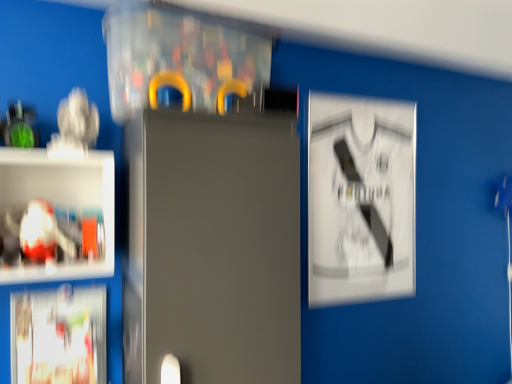
At what (x,y) coordinates should I click in order to perform the action: click on transparent plastic cabinet at upper center. Please return your answer as a coordinate pair (x, y). This screenshot has height=384, width=512. Looking at the image, I should click on (182, 57).

You are a GUI agent. You are given a task and a screenshot of the screen. Output one action in this format:
    pyautogui.click(x=<x>, y=<y>)
    Task: Click on the satin gray fridge at center
    The image size is (512, 384).
    Given the screenshot: What is the action you would take?
    pyautogui.click(x=212, y=248)

Identify the location of transparent plastic cabinet at upper center. The image size is (512, 384). (182, 57).

From the image's perspective, is white paper at upper right, which is counted as the first poster, starting from the right, located above translucent plastic shelf at left?

Yes, from the image's perspective, white paper at upper right, which is counted as the first poster, starting from the right, is above translucent plastic shelf at left.

Considering the relative sizes of white paper at upper right, acting as the 1th poster starting from the top, and translucent plastic shelf at left in the image provided, is white paper at upper right, acting as the 1th poster starting from the top, thinner than translucent plastic shelf at left?

Correct, the width of white paper at upper right, acting as the 1th poster starting from the top, is less than that of translucent plastic shelf at left.

How many degrees apart are the facing directions of white paper at upper right, the 2th poster from the left, and translucent plastic shelf at left?

The angular difference between white paper at upper right, the 2th poster from the left, and translucent plastic shelf at left is 0.109 degrees.

Could you tell me if white paper at upper right, acting as the 1th poster starting from the top, is facing translucent plastic shelf at left?

No, white paper at upper right, acting as the 1th poster starting from the top, is not facing towards translucent plastic shelf at left.

From a real-world perspective, relative to white glossy poster at lower left, acting as the 2th poster starting from the back, is satin gray fridge at center vertically above or below?

satin gray fridge at center is above white glossy poster at lower left, acting as the 2th poster starting from the back.

Considering the relative sizes of satin gray fridge at center and white glossy poster at lower left, which is counted as the first poster, starting from the left, in the image provided, is satin gray fridge at center shorter than white glossy poster at lower left, which is counted as the first poster, starting from the left,?

No, satin gray fridge at center is not shorter than white glossy poster at lower left, which is counted as the first poster, starting from the left.

Are satin gray fridge at center and white glossy poster at lower left, the 1th poster when ordered from front to back, located far from each other?

No, satin gray fridge at center is in close proximity to white glossy poster at lower left, the 1th poster when ordered from front to back.

Is the depth of satin gray fridge at center greater than that of white glossy poster at lower left, which is counted as the 2th poster, starting from the right?

No, it is in front of white glossy poster at lower left, which is counted as the 2th poster, starting from the right.

Are translucent plastic shelf at left and transparent plastic cabinet at upper center far apart?

translucent plastic shelf at left is actually quite close to transparent plastic cabinet at upper center.

In the scene shown: From the image's perspective, is translucent plastic shelf at left below transparent plastic cabinet at upper center?

Yes, from the image's perspective, translucent plastic shelf at left is below transparent plastic cabinet at upper center.

Based on the photo, could you tell me if translucent plastic shelf at left is turned towards transparent plastic cabinet at upper center?

No.

Is white paper at upper right, the 1th poster when ordered from back to front, turned away from white glossy poster at lower left, the first poster positioned from the bottom?

No, white paper at upper right, the 1th poster when ordered from back to front, is not facing the opposite direction of white glossy poster at lower left, the first poster positioned from the bottom.

From the image's perspective, relative to white glossy poster at lower left, the first poster positioned from the bottom, is white paper at upper right, the 2th poster when ordered from front to back, above or below?

Clearly, from the image's perspective, white paper at upper right, the 2th poster when ordered from front to back, is above white glossy poster at lower left, the first poster positioned from the bottom.

Can you tell me how much white paper at upper right, the 2th poster from the left, and white glossy poster at lower left, which is counted as the first poster, starting from the left, differ in facing direction?

The angle between the facing direction of white paper at upper right, the 2th poster from the left, and the facing direction of white glossy poster at lower left, which is counted as the first poster, starting from the left, is 1.07 degrees.

Could you measure the distance between white paper at upper right, the 2th poster when ordered from front to back, and white glossy poster at lower left, which is counted as the 2th poster, starting from the right?

They are 1.11 meters apart.

Considering the sizes of objects white paper at upper right, acting as the 1th poster starting from the top, and transparent plastic cabinet at upper center in the image provided, who is taller, white paper at upper right, acting as the 1th poster starting from the top, or transparent plastic cabinet at upper center?

white paper at upper right, acting as the 1th poster starting from the top.

Does white paper at upper right, the 1th poster when ordered from back to front, contain transparent plastic cabinet at upper center?

Actually, transparent plastic cabinet at upper center is outside white paper at upper right, the 1th poster when ordered from back to front.

Considering the sizes of objects white paper at upper right, the 2th poster when ordered from bottom to top, and transparent plastic cabinet at upper center in the image provided, who is bigger, white paper at upper right, the 2th poster when ordered from bottom to top, or transparent plastic cabinet at upper center?

transparent plastic cabinet at upper center.

In the scene shown: In the image, is white paper at upper right, the 2th poster from the left, positioned in front of or behind transparent plastic cabinet at upper center?

Clearly, white paper at upper right, the 2th poster from the left, is behind transparent plastic cabinet at upper center.

From a real-world perspective, is transparent plastic cabinet at upper center on top of translucent plastic shelf at left?

Yes.

In the scene shown: Which of these two, transparent plastic cabinet at upper center or translucent plastic shelf at left, stands taller?

Standing taller between the two is translucent plastic shelf at left.

Consider the image. Is transparent plastic cabinet at upper center positioned before translucent plastic shelf at left?

No, transparent plastic cabinet at upper center is behind translucent plastic shelf at left.

Which is in front, point (218, 106) or point (92, 174)?

The point (218, 106) is in front.

From a real-world perspective, between white glossy poster at lower left, which is counted as the 2th poster, starting from the right, and transparent plastic cabinet at upper center, who is vertically lower?

white glossy poster at lower left, which is counted as the 2th poster, starting from the right, is physically lower.

Who is taller, white glossy poster at lower left, acting as the 2th poster starting from the top, or transparent plastic cabinet at upper center?

→ white glossy poster at lower left, acting as the 2th poster starting from the top, is taller.

Based on the photo, which object is more forward, white glossy poster at lower left, which is counted as the 2th poster, starting from the right, or transparent plastic cabinet at upper center?

transparent plastic cabinet at upper center.

From the image's perspective, relative to transparent plastic cabinet at upper center, is white glossy poster at lower left, which is counted as the 2th poster, starting from the right, above or below?

Clearly, from the image's perspective, white glossy poster at lower left, which is counted as the 2th poster, starting from the right, is below transparent plastic cabinet at upper center.

There is a translucent plastic shelf at left. Identify the location of poster above it (from a real-world perspective). (360, 199).

Where is `fridge on the right of white glossy poster at lower left, acting as the 2th poster starting from the top`? This screenshot has height=384, width=512. fridge on the right of white glossy poster at lower left, acting as the 2th poster starting from the top is located at coordinates (212, 248).

Looking at the image, which one is located closer to translucent plastic shelf at left, white paper at upper right, which is counted as the first poster, starting from the right, or satin gray fridge at center?

satin gray fridge at center is positioned closer to the anchor translucent plastic shelf at left.

Looking at the image, which one is located further to transparent plastic cabinet at upper center, white paper at upper right, the 2th poster from the left, or translucent plastic shelf at left?

The object further to transparent plastic cabinet at upper center is white paper at upper right, the 2th poster from the left.

When comparing their distances from white glossy poster at lower left, which is counted as the first poster, starting from the left, does satin gray fridge at center or translucent plastic shelf at left seem further?

satin gray fridge at center is further to white glossy poster at lower left, which is counted as the first poster, starting from the left.

Which object lies further to the anchor point white glossy poster at lower left, acting as the 2th poster starting from the top, translucent plastic shelf at left or white paper at upper right, the 1th poster when ordered from back to front?

white paper at upper right, the 1th poster when ordered from back to front, lies further to white glossy poster at lower left, acting as the 2th poster starting from the top, than the other object.

Based on their spatial positions, is white glossy poster at lower left, which is counted as the 2th poster, starting from the right, or transparent plastic cabinet at upper center further from satin gray fridge at center?

white glossy poster at lower left, which is counted as the 2th poster, starting from the right, is positioned further to the anchor satin gray fridge at center.

Based on their spatial positions, is white paper at upper right, the 2th poster when ordered from front to back, or white glossy poster at lower left, which is counted as the 2th poster, starting from the right, further from transparent plastic cabinet at upper center?

white glossy poster at lower left, which is counted as the 2th poster, starting from the right, is further to transparent plastic cabinet at upper center.

Based on their spatial positions, is translucent plastic shelf at left or white paper at upper right, the 1th poster when ordered from back to front, closer to satin gray fridge at center?

translucent plastic shelf at left.

Which object lies further to the anchor point white paper at upper right, the 1th poster when ordered from back to front, transparent plastic cabinet at upper center or white glossy poster at lower left, acting as the 2th poster starting from the top?

The object further to white paper at upper right, the 1th poster when ordered from back to front, is white glossy poster at lower left, acting as the 2th poster starting from the top.

Find the location of a particular element. The height and width of the screenshot is (384, 512). fridge situated between translucent plastic shelf at left and white paper at upper right, the 2th poster when ordered from bottom to top, from left to right is located at coordinates (212, 248).

Image resolution: width=512 pixels, height=384 pixels. Identify the location of shelf between white glossy poster at lower left, the 1th poster when ordered from front to back, and satin gray fridge at center. (57, 215).

The width and height of the screenshot is (512, 384). Find the location of `shelf between transparent plastic cabinet at upper center and white glossy poster at lower left, the first poster positioned from the bottom, from top to bottom`. shelf between transparent plastic cabinet at upper center and white glossy poster at lower left, the first poster positioned from the bottom, from top to bottom is located at coordinates (57, 215).

Where is `cabinet located between translucent plastic shelf at left and white paper at upper right, the 1th poster when ordered from back to front, in the left-right direction`? The height and width of the screenshot is (384, 512). cabinet located between translucent plastic shelf at left and white paper at upper right, the 1th poster when ordered from back to front, in the left-right direction is located at coordinates (182, 57).